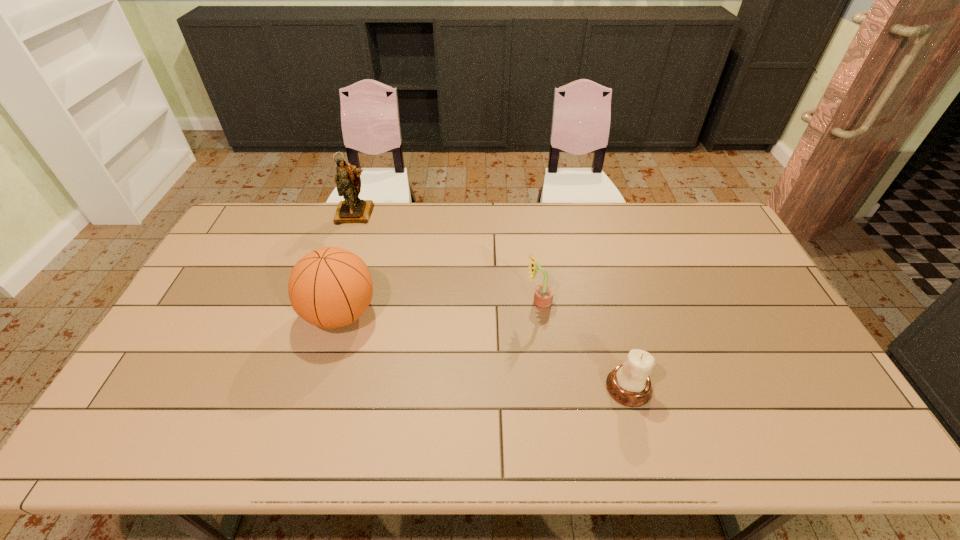
At what (x,y) coordinates should I click in order to perform the action: click on vacant space that's between the farthest object and the sunflower. Please return your answer as a coordinate pair (x, y). The width and height of the screenshot is (960, 540). Looking at the image, I should click on (447, 258).

Where is `empty location between the third tallest object and the figurine`? The image size is (960, 540). empty location between the third tallest object and the figurine is located at coordinates (447, 258).

At what (x,y) coordinates should I click in order to perform the action: click on blank region between the rightmost object and the second object from right to left. Please return your answer as a coordinate pair (x, y). The height and width of the screenshot is (540, 960). Looking at the image, I should click on (584, 345).

I want to click on vacant space that's between the third tallest object and the figurine, so click(447, 258).

The width and height of the screenshot is (960, 540). I want to click on empty location between the third tallest object and the candle holder, so click(584, 345).

Image resolution: width=960 pixels, height=540 pixels. What are the coordinates of `object that can be found as the second closest to the nearest object` in the screenshot? It's located at (330, 287).

The image size is (960, 540). In order to click on object that is the nearest to the basketball in this screenshot , I will do `click(352, 210)`.

You are a GUI agent. You are given a task and a screenshot of the screen. Output one action in this format:
    pyautogui.click(x=<x>, y=<y>)
    Task: Click on the free spot that satisfies the following two spatial constraints: 1. on the face of the second shortest object; 2. on the back side of the rightmost object
    The image size is (960, 540).
    Given the screenshot: What is the action you would take?
    pyautogui.click(x=549, y=387)

Where is `vacant space that satisfies the following two spatial constraints: 1. on the face of the second object from right to left; 2. on the front side of the basketball`? This screenshot has width=960, height=540. vacant space that satisfies the following two spatial constraints: 1. on the face of the second object from right to left; 2. on the front side of the basketball is located at coordinates pos(540,314).

The height and width of the screenshot is (540, 960). Identify the location of free spot that satisfies the following two spatial constraints: 1. on the face of the third object from left to right; 2. on the left side of the candle holder. [549, 387].